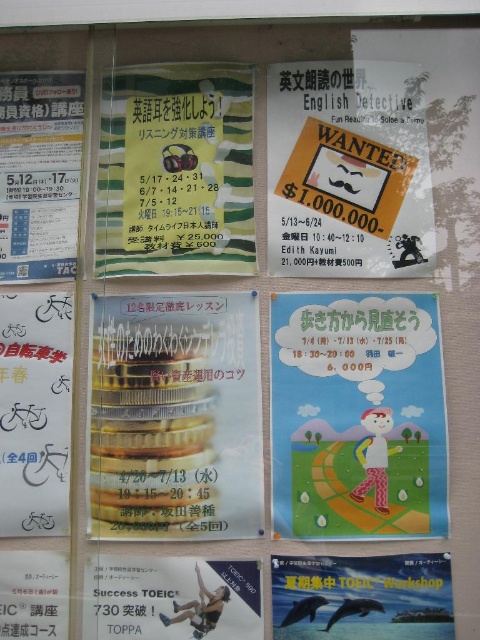
Question: Which object appears farthest from the camera in this image?

Choices:
 (A) matte paper wanted poster at center
 (B) gold metallic coins at center

Answer: (A)

Question: Does matte paper poster at left appear on the left side of white paper poster at lower left?

Choices:
 (A) yes
 (B) no

Answer: (A)

Question: Can you confirm if gold metallic coins at center is positioned to the left of matte paper poster at left?

Choices:
 (A) no
 (B) yes

Answer: (A)

Question: Is white paper bicycle at left smaller than blue glossy dolphin at center?

Choices:
 (A) no
 (B) yes

Answer: (A)

Question: Based on their relative distances, which object is nearer to the matte paper poster at left?

Choices:
 (A) yellow-green textured poster at upper center
 (B) white paper poster at lower left
 (C) matte blue poster at center right

Answer: (A)

Question: Which object is the farthest from the matte paper poster at left?

Choices:
 (A) matte blue poster at center right
 (B) matte paper wanted poster at center
 (C) white paper bicycle at left
 (D) matte blue poster at lower center

Answer: (D)